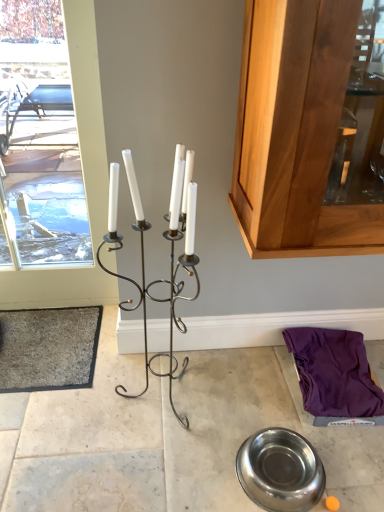
Locate an element on the screen. The image size is (384, 512). free space on the front side of gray carpet at lower left is located at coordinates (52, 435).